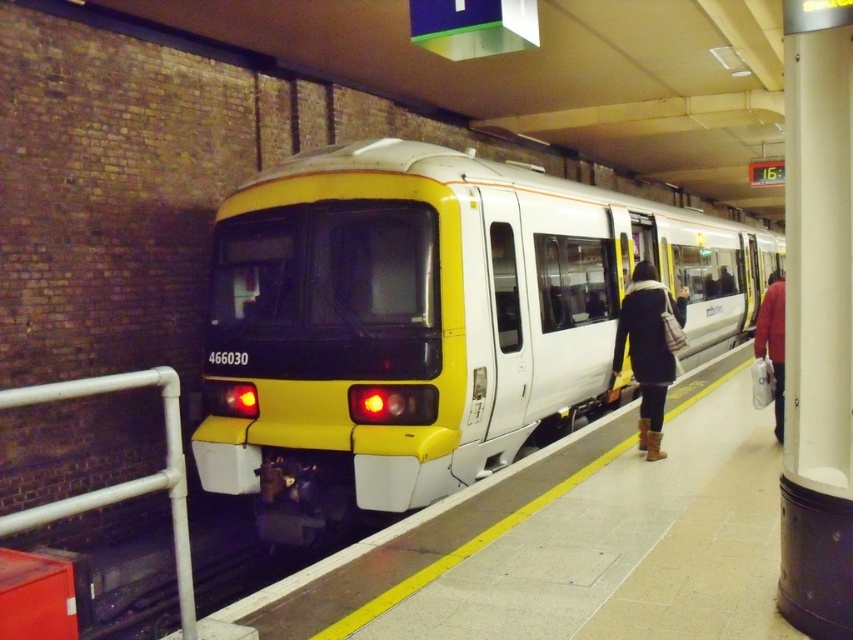
Question: From the image, what is the correct spatial relationship of yellow matte train at center in relation to dark brown leather boots at lower right?

Choices:
 (A) above
 (B) below

Answer: (A)

Question: Which object is positioned closest to the red leather jacket at right?

Choices:
 (A) white glossy rail at left
 (B) dark brown leather boots at lower right

Answer: (B)

Question: Can you confirm if white glossy rail at left is bigger than dark brown leather boots at lower right?

Choices:
 (A) yes
 (B) no

Answer: (B)

Question: Which of the following is the closest to the observer?

Choices:
 (A) (779, 387)
 (B) (531, 369)
 (C) (619, 333)

Answer: (A)

Question: Is yellow matte train at center wider than red leather jacket at right?

Choices:
 (A) no
 (B) yes

Answer: (B)

Question: Which is nearer to the white glossy rail at left?

Choices:
 (A) red leather jacket at right
 (B) dark brown leather boots at lower right

Answer: (B)